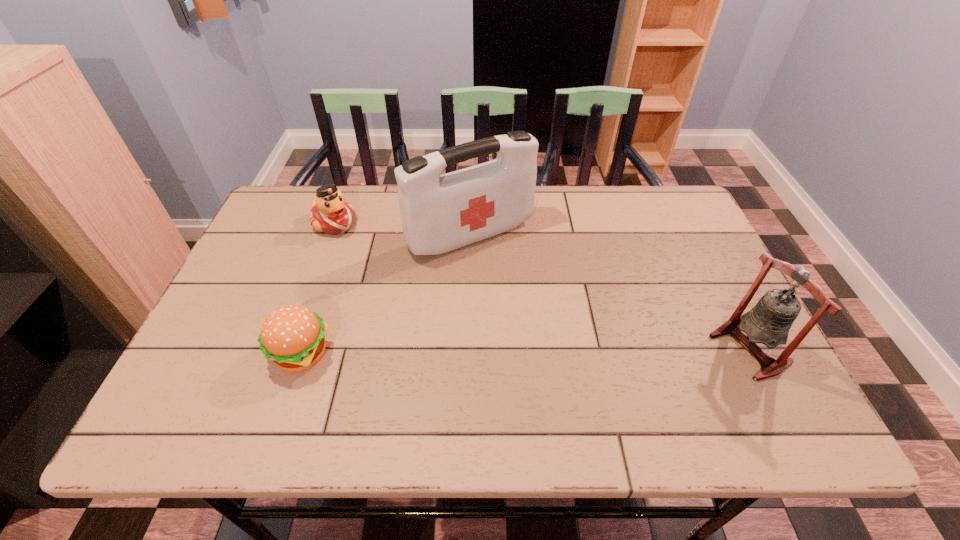
Locate an element on the screen. The width and height of the screenshot is (960, 540). free space between the hamburger and the second object from right to left is located at coordinates pyautogui.click(x=386, y=294).

This screenshot has width=960, height=540. Find the location of `unoccupied area between the bell and the first-aid kit`. unoccupied area between the bell and the first-aid kit is located at coordinates (610, 292).

The height and width of the screenshot is (540, 960). Identify the location of vacant space that is in between the rightmost object and the hamburger. (525, 351).

Select which object appears as the closest to the first-aid kit. Please provide its 2D coordinates. Your answer should be formatted as a tuple, i.e. [(x, y)], where the tuple contains the x and y coordinates of a point satisfying the conditions above.

[(330, 213)]

Where is `object that stands as the second closest to the bell`? The image size is (960, 540). object that stands as the second closest to the bell is located at coordinates (292, 336).

The width and height of the screenshot is (960, 540). I want to click on vacant space that satisfies the following two spatial constraints: 1. on the front side of the bell; 2. on the left side of the first-aid kit, so click(x=468, y=349).

The width and height of the screenshot is (960, 540). I want to click on free space that satisfies the following two spatial constraints: 1. on the back side of the bell; 2. on the right side of the hamburger, so click(302, 349).

Identify the location of vacant space that satisfies the following two spatial constraints: 1. on the front side of the duck; 2. on the right side of the hamburger. Image resolution: width=960 pixels, height=540 pixels. (288, 354).